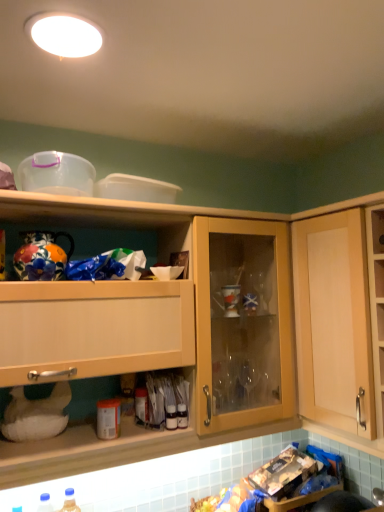
Question: Considering the relative sizes of wooden cabinet at upper center, which appears as the second cabinetry when viewed from the right, and matte plastic bottle at center, which is the 2th bottle from right to left, in the image provided, is wooden cabinet at upper center, which appears as the second cabinetry when viewed from the right, thinner than matte plastic bottle at center, which is the 2th bottle from right to left,?

Choices:
 (A) no
 (B) yes

Answer: (A)

Question: Would you say matte plastic bottle at center, positioned as the 3th bottle in bottom-to-top order, is part of wooden cabinet at upper center, which appears as the second cabinetry when viewed from the right,'s contents?

Choices:
 (A) no
 (B) yes

Answer: (B)

Question: From a real-world perspective, is wooden cabinet at upper center, arranged as the first cabinetry when viewed from the left, located higher than matte plastic bottle at center, which is the 2th bottle from right to left?

Choices:
 (A) no
 (B) yes

Answer: (B)

Question: Does wooden cabinet at upper center, arranged as the first cabinetry when viewed from the left, have a lesser height compared to matte plastic bottle at center, acting as the 2th bottle starting from the left?

Choices:
 (A) yes
 (B) no

Answer: (B)

Question: From the image's perspective, is wooden cabinet at upper center, which appears as the second cabinetry when viewed from the right, beneath matte plastic bottle at center, positioned as the 3th bottle in bottom-to-top order?

Choices:
 (A) yes
 (B) no

Answer: (B)

Question: Is point (175, 409) positioned closer to the camera than point (71, 459)?

Choices:
 (A) farther
 (B) closer

Answer: (A)

Question: From the image's perspective, is translucent plastic bottle at center, arranged as the 3th bottle when viewed from the left, located above or below wooden cabinet at upper center, which appears as the second cabinetry when viewed from the right?

Choices:
 (A) above
 (B) below

Answer: (B)

Question: Considering the positions of translucent plastic bottle at center, positioned as the second bottle in bottom-to-top order, and wooden cabinet at upper center, which appears as the second cabinetry when viewed from the right, in the image, is translucent plastic bottle at center, positioned as the second bottle in bottom-to-top order, wider or thinner than wooden cabinet at upper center, which appears as the second cabinetry when viewed from the right,?

Choices:
 (A) thin
 (B) wide

Answer: (A)

Question: Considering the positions of translucent plastic bottle at center, which is the second bottle from top to bottom, and wooden cabinet at upper center, arranged as the first cabinetry when viewed from the left, in the image, is translucent plastic bottle at center, which is the second bottle from top to bottom, taller or shorter than wooden cabinet at upper center, arranged as the first cabinetry when viewed from the left,?

Choices:
 (A) short
 (B) tall

Answer: (A)

Question: Is point tap(175, 423) positioned closer to the camera than point tap(89, 31)?

Choices:
 (A) farther
 (B) closer

Answer: (A)

Question: From the image's perspective, is translucent plastic bottle at center, which appears as the first bottle when viewed from the right, positioned above or below white glossy light fixture at upper center?

Choices:
 (A) above
 (B) below

Answer: (B)

Question: Is translucent plastic bottle at center, arranged as the 3th bottle when viewed from the left, wider or thinner than white glossy light fixture at upper center?

Choices:
 (A) thin
 (B) wide

Answer: (A)

Question: Considering their positions, is translucent plastic bottle at center, which appears as the first bottle when viewed from the right, located in front of or behind white glossy light fixture at upper center?

Choices:
 (A) behind
 (B) front

Answer: (A)

Question: From a real-world perspective, is matte plastic bottle at center, acting as the 2th bottle starting from the left, physically located above or below white glossy light fixture at upper center?

Choices:
 (A) below
 (B) above

Answer: (A)

Question: Is matte plastic bottle at center, which is the 2th bottle from right to left, wider or thinner than white glossy light fixture at upper center?

Choices:
 (A) wide
 (B) thin

Answer: (B)